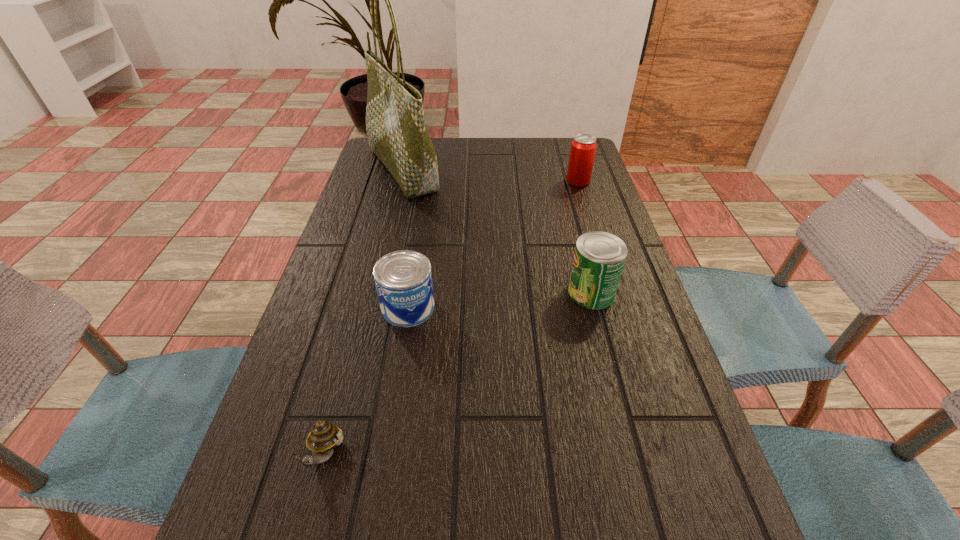
At what (x,y) coordinates should I click in order to perform the action: click on the tallest object. Please return your answer as a coordinate pair (x, y). Image resolution: width=960 pixels, height=540 pixels. Looking at the image, I should click on (397, 132).

Find the location of `the farthest can`. the farthest can is located at coordinates (583, 147).

The image size is (960, 540). What are the coordinates of `the shortest can` in the screenshot? It's located at (403, 279).

I want to click on snail, so click(x=324, y=436).

Where is `free space located on the right of the tallest object`? Image resolution: width=960 pixels, height=540 pixels. free space located on the right of the tallest object is located at coordinates (488, 169).

At what (x,y) coordinates should I click in order to perform the action: click on vacant space located 0.370m on the front of the farthest can. Please return your answer as a coordinate pair (x, y). Looking at the image, I should click on (606, 272).

What are the coordinates of `free space located on the front label of the leftmost can` in the screenshot? It's located at click(x=374, y=515).

The image size is (960, 540). What are the coordinates of `object located at the far edge` in the screenshot? It's located at (397, 132).

Where is `shopping bag at the left edge`? shopping bag at the left edge is located at coordinates (397, 132).

Find the location of `can at the left edge`. can at the left edge is located at coordinates (403, 279).